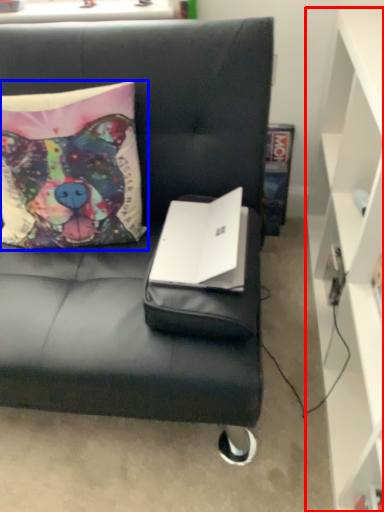
Question: Which point is closer to the camera, cabinetry (highlighted by a red box) or pillow (highlighted by a blue box)?

Choices:
 (A) cabinetry
 (B) pillow

Answer: (A)